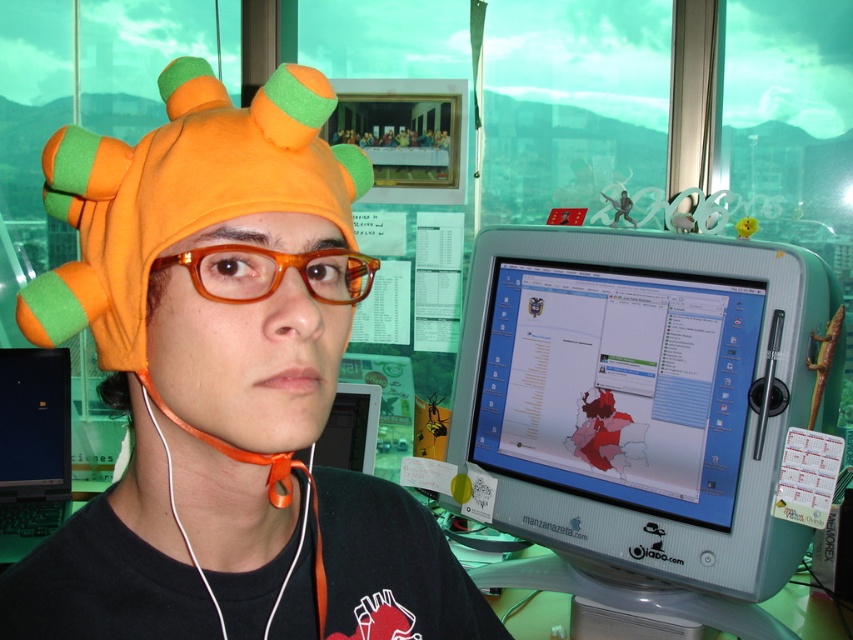
You are an office worker who needs to place a new sticker on your desk. The orange felt hat at left is currently at position 0.606, 0.265. If you want to place the sticker 10 cm to the right of the hat, where should you place it?

The orange felt hat at left is located at point (225, 387). To place the sticker 10 cm to the right, you would move it to the coordinates (225, 451).

You are standing in the office shown in the image. You need to locate the black glossy laptop at left. Where is it placed in terms of coordinates?

The black glossy laptop at left is located at point coordinates of (32,445).

You are an office worker who needs to adjust the position of the orange felt hat at left and the matte plastic monitor at center. Based on their current positions, which object is nearer to you?

The orange felt hat at left is closer to the viewer than the matte plastic monitor at center, so the orange felt hat at left is nearer to you.